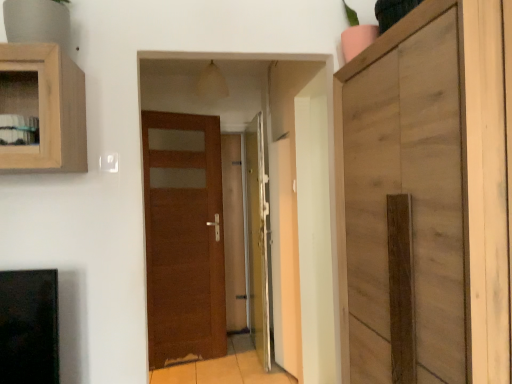
Question: From the image's perspective, would you say transparent glass door at center is shown under wooden cabinet at right?

Choices:
 (A) no
 (B) yes

Answer: (B)

Question: Is transparent glass door at center looking in the opposite direction of wooden cabinet at right?

Choices:
 (A) yes
 (B) no

Answer: (B)

Question: Considering the relative sizes of transparent glass door at center and wooden cabinet at right in the image provided, is transparent glass door at center smaller than wooden cabinet at right?

Choices:
 (A) yes
 (B) no

Answer: (A)

Question: Is transparent glass door at center shorter than wooden cabinet at right?

Choices:
 (A) yes
 (B) no

Answer: (B)

Question: From a real-world perspective, is transparent glass door at center positioned over wooden cabinet at right based on gravity?

Choices:
 (A) no
 (B) yes

Answer: (A)

Question: Considering the relative sizes of transparent glass door at center and wooden cabinet at right in the image provided, is transparent glass door at center wider than wooden cabinet at right?

Choices:
 (A) yes
 (B) no

Answer: (B)

Question: From the image's perspective, is brown wood door at center, the first door when ordered from left to right, beneath transparent glass door at center?

Choices:
 (A) yes
 (B) no

Answer: (A)

Question: From the image's perspective, does brown wood door at center, the first door when ordered from left to right, appear higher than transparent glass door at center?

Choices:
 (A) yes
 (B) no

Answer: (B)

Question: Is brown wood door at center, the first door when ordered from left to right, bigger than transparent glass door at center?

Choices:
 (A) no
 (B) yes

Answer: (A)

Question: Does brown wood door at center, arranged as the second door when viewed from the right, have a smaller size compared to transparent glass door at center?

Choices:
 (A) no
 (B) yes

Answer: (B)

Question: Does brown wood door at center, arranged as the second door when viewed from the right, contain transparent glass door at center?

Choices:
 (A) yes
 (B) no

Answer: (B)

Question: Is transparent glass door at center at the back of brown wood door at center, the first door when ordered from left to right?

Choices:
 (A) no
 (B) yes

Answer: (B)

Question: Can you confirm if transparent glass door at center is positioned to the right of brown wood door at center, the first door when ordered from left to right?

Choices:
 (A) no
 (B) yes

Answer: (B)